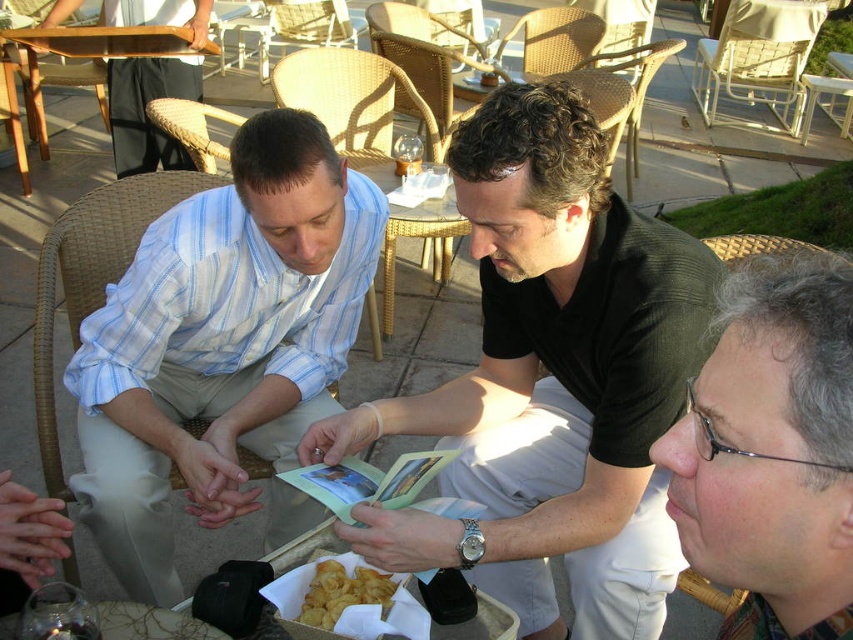
Question: Is light blue striped shirt at left thinner than wooden table at upper left?

Choices:
 (A) yes
 (B) no

Answer: (A)

Question: Which object is closer to the camera taking this photo?

Choices:
 (A) wooden table at upper left
 (B) gray textured hair at lower right

Answer: (B)

Question: Is wooden table at upper left smaller than white paper tray at lower center?

Choices:
 (A) no
 (B) yes

Answer: (A)

Question: Is black matte shirt at center to the left of gray textured hair at lower right from the viewer's perspective?

Choices:
 (A) no
 (B) yes

Answer: (B)

Question: Which point is farther from the camera taking this photo?

Choices:
 (A) (38, 102)
 (B) (21, 68)
 (C) (479, 593)

Answer: (B)

Question: Among these objects, which one is farthest from the camera?

Choices:
 (A) wooden table at upper left
 (B) light blue striped shirt at left
 (C) wicker chair at upper right
 (D) golden crispy chips at lower center

Answer: (C)